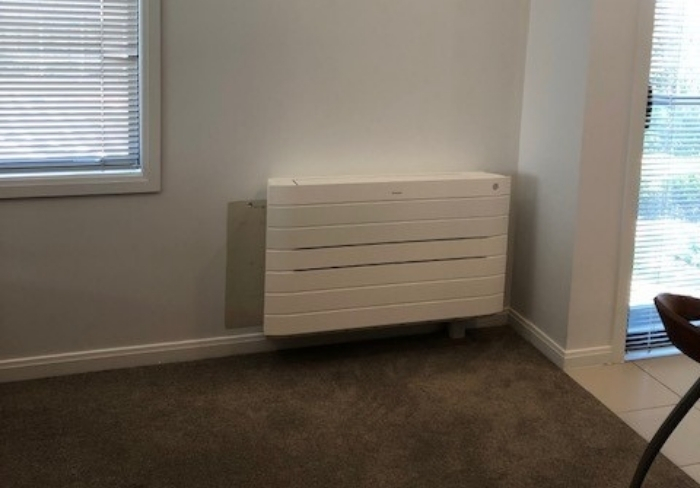
Identify the location of wall. Image resolution: width=700 pixels, height=488 pixels. (556, 80).